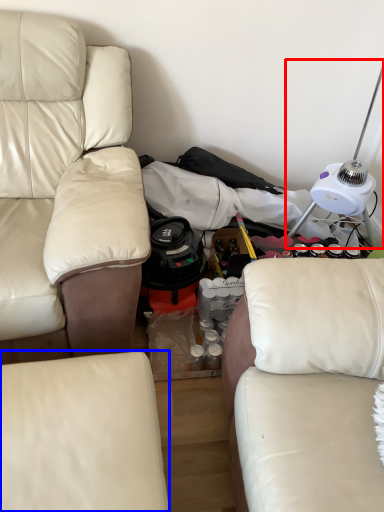
Question: Among these objects, which one is nearest to the camera, table lamp (highlighted by a red box) or studio couch (highlighted by a blue box)?

Choices:
 (A) table lamp
 (B) studio couch

Answer: (B)